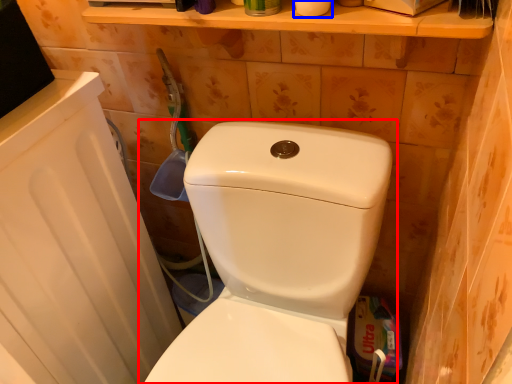
Question: Which object appears farthest to the camera in this image, toilet (highlighted by a red box) or toilet paper (highlighted by a blue box)?

Choices:
 (A) toilet
 (B) toilet paper

Answer: (B)